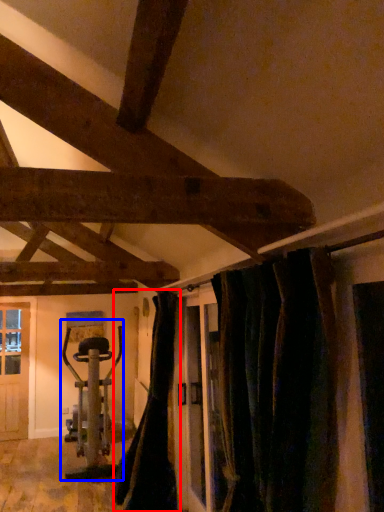
Question: Which point is closer to the camera, curtain (highlighted by a red box) or sport equipment (highlighted by a blue box)?

Choices:
 (A) curtain
 (B) sport equipment

Answer: (A)